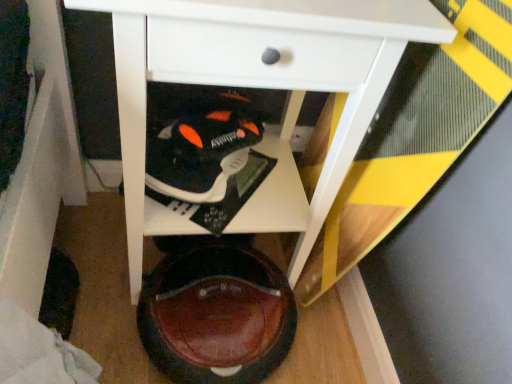
Find the location of `free space above brown leather shoe at lower center, arranged as the 1th footwear when ordered from the bottom (from a real-world perspective)`. free space above brown leather shoe at lower center, arranged as the 1th footwear when ordered from the bottom (from a real-world perspective) is located at coordinates (219, 305).